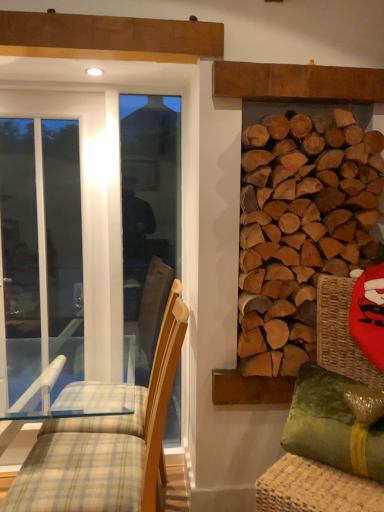
This screenshot has width=384, height=512. Describe the element at coordinates (107, 445) in the screenshot. I see `light brown wood chair at left` at that location.

In order to face natural wood logs at right, should I rotate leftwards or rightwards?

Rotate your view right by about 14.706°.

This screenshot has height=512, width=384. In order to click on natural wood logs at right in this screenshot , I will do `click(300, 227)`.

Image resolution: width=384 pixels, height=512 pixels. Describe the element at coordinates (312, 489) in the screenshot. I see `green fabric swivel chair at right` at that location.

The width and height of the screenshot is (384, 512). I want to click on white glass screen door at left, so click(41, 228).

Consider the image. Considering the relative positions of light brown wood chair at left and green velvet pillow at lower right in the image provided, is light brown wood chair at left to the left of green velvet pillow at lower right from the viewer's perspective?

Yes.

Is green velvet pillow at lower right surrounded by light brown wood chair at left?

That's incorrect, green velvet pillow at lower right is not inside light brown wood chair at left.

From a real-world perspective, is light brown wood chair at left positioned under green velvet pillow at lower right based on gravity?

Yes, from a real-world perspective, light brown wood chair at left is below green velvet pillow at lower right.

Which is behind, point (99, 462) or point (294, 405)?

Positioned behind is point (294, 405).

In the scene shown: Does green fabric swivel chair at right have a lesser height compared to green velvet pillow at lower right?

In fact, green fabric swivel chair at right may be taller than green velvet pillow at lower right.

Can green velvet pillow at lower right be found inside green fabric swivel chair at right?

Yes, green velvet pillow at lower right is a part of green fabric swivel chair at right.

Which of these two, green fabric swivel chair at right or green velvet pillow at lower right, is bigger?

green fabric swivel chair at right.

Is point (337, 312) farther from camera compared to point (315, 382)?

Yes.

Do you think green fabric swivel chair at right is within light brown wood chair at left, or outside of it?

green fabric swivel chair at right is located beyond the bounds of light brown wood chair at left.

Does green fabric swivel chair at right appear on the left side of light brown wood chair at left?

No.

Which of these two, green fabric swivel chair at right or light brown wood chair at left, stands shorter?

Standing shorter between the two is light brown wood chair at left.

Does point (367, 503) appear closer or farther from the camera than point (35, 486)?

Point (367, 503) appears to be closer to the viewer than point (35, 486).

From the image's perspective, is green velvet pillow at lower right under natural wood logs at right?

Yes, from the image's perspective, green velvet pillow at lower right is below natural wood logs at right.

Is green velvet pillow at lower right not within natural wood logs at right?

Yes, green velvet pillow at lower right is not within natural wood logs at right.

From a real-world perspective, is green velvet pillow at lower right beneath natural wood logs at right?

Yes.

Is green velvet pillow at lower right directly adjacent to natural wood logs at right?

No, green velvet pillow at lower right is not making contact with natural wood logs at right.

I want to click on swivel chair to the right of white glass screen door at left, so click(312, 489).

Can you confirm if white glass screen door at left is positioned to the left of green fabric swivel chair at right?

Indeed, white glass screen door at left is positioned on the left side of green fabric swivel chair at right.

Does white glass screen door at left lie in front of green fabric swivel chair at right?

No, it is not.

Which of these two, white glass screen door at left or green fabric swivel chair at right, is thinner?

Thinner between the two is white glass screen door at left.

From their relative heights in the image, would you say light brown wood chair at left is taller or shorter than white glass screen door at left?

In the image, light brown wood chair at left appears to be shorter than white glass screen door at left.

Can you confirm if light brown wood chair at left is smaller than white glass screen door at left?

Actually, light brown wood chair at left might be larger than white glass screen door at left.

Based on the photo, could you tell me if light brown wood chair at left is turned towards white glass screen door at left?

No, light brown wood chair at left is not turned towards white glass screen door at left.

From the picture: How different are the orientations of light brown wood chair at left and white glass screen door at left in degrees?

92.4 degrees.

From a real-world perspective, which is physically above, green fabric swivel chair at right or natural wood logs at right?

natural wood logs at right.

Consider the image. Considering the sizes of green fabric swivel chair at right and natural wood logs at right in the image, is green fabric swivel chair at right taller or shorter than natural wood logs at right?

In the image, green fabric swivel chair at right appears to be shorter than natural wood logs at right.

Is green fabric swivel chair at right turned away from natural wood logs at right?

Answer: No.

Is point (333, 293) positioned before point (295, 170)?

No, (333, 293) is behind (295, 170).

The height and width of the screenshot is (512, 384). I want to click on chair below the green velvet pillow at lower right (from the image's perspective), so click(x=107, y=445).

Where is `pillow located above the green fabric swivel chair at right (from the image's perspective)`? pillow located above the green fabric swivel chair at right (from the image's perspective) is located at coordinates (332, 425).

Considering their positions, is white glass screen door at left positioned further to green fabric swivel chair at right than natural wood logs at right?

Among the two, white glass screen door at left is located further to green fabric swivel chair at right.

Estimate the real-world distances between objects in this image. Which object is further from light brown wood chair at left, green velvet pillow at lower right or natural wood logs at right?

Based on the image, green velvet pillow at lower right appears to be further to light brown wood chair at left.

Which object lies further to the anchor point green velvet pillow at lower right, natural wood logs at right or green fabric swivel chair at right?

natural wood logs at right lies further to green velvet pillow at lower right than the other object.

When comparing their distances from light brown wood chair at left, does white glass screen door at left or natural wood logs at right seem closer?

natural wood logs at right.

Considering their positions, is natural wood logs at right positioned further to white glass screen door at left than green fabric swivel chair at right?

The object further to white glass screen door at left is green fabric swivel chair at right.

Which object lies nearer to the anchor point white glass screen door at left, light brown wood chair at left or natural wood logs at right?

Among the two, light brown wood chair at left is located nearer to white glass screen door at left.

Looking at the image, which one is located closer to natural wood logs at right, white glass screen door at left or light brown wood chair at left?

light brown wood chair at left is positioned closer to the anchor natural wood logs at right.

Looking at the image, which one is located further to white glass screen door at left, natural wood logs at right or light brown wood chair at left?

natural wood logs at right is positioned further to the anchor white glass screen door at left.

Find the location of a particular element. The width and height of the screenshot is (384, 512). hardwood between light brown wood chair at left and green velvet pillow at lower right in the horizontal direction is located at coordinates (300, 227).

Identify the location of pillow situated between light brown wood chair at left and green fabric swivel chair at right from left to right. The image size is (384, 512). (332, 425).

The height and width of the screenshot is (512, 384). Find the location of `hardwood between white glass screen door at left and green fabric swivel chair at right`. hardwood between white glass screen door at left and green fabric swivel chair at right is located at coordinates (300, 227).

The width and height of the screenshot is (384, 512). In order to click on chair between white glass screen door at left and green velvet pillow at lower right in the horizontal direction in this screenshot , I will do `click(107, 445)`.